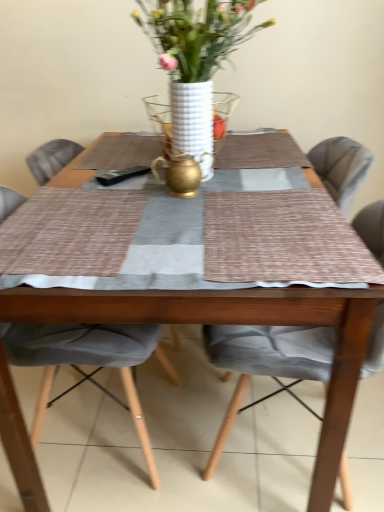
In order to click on space that is in front of white ceramic vase at center in this screenshot , I will do `click(229, 243)`.